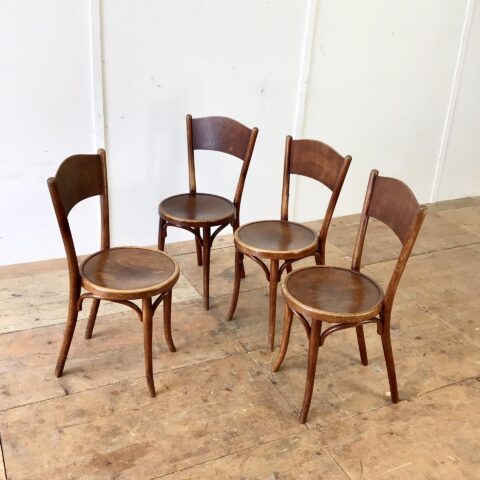
At what (x,y) coordinates should I click in order to perform the action: click on chair back. Please return your answer as a coordinate pair (x, y). The height and width of the screenshot is (480, 480). Looking at the image, I should click on (82, 182), (220, 141), (320, 157), (403, 207).